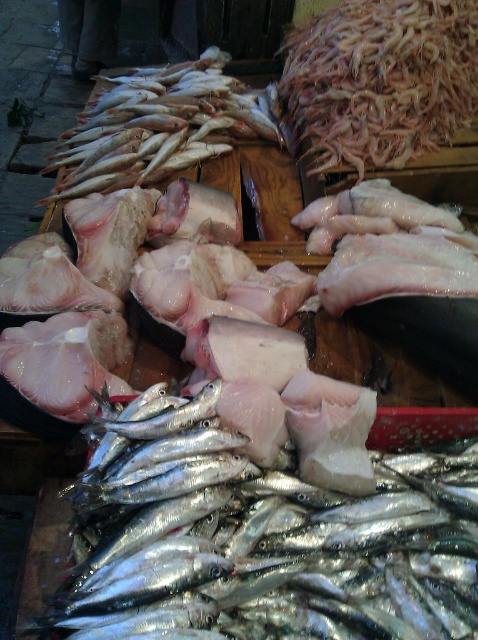
Question: Does pinkish-white shrimp at upper center appear on the right side of shiny silver fish at upper left?

Choices:
 (A) no
 (B) yes

Answer: (B)

Question: Which point is closer to the camera taking this photo?

Choices:
 (A) (401, 554)
 (B) (360, 164)

Answer: (A)

Question: Which object is farther from the camera taking this photo?

Choices:
 (A) shiny silver fish at upper left
 (B) pinkish-white shrimp at upper center

Answer: (A)

Question: Which object is positioned farthest from the shiny silver fish at center?

Choices:
 (A) pinkish-white shrimp at upper center
 (B) shiny silver fish at upper left

Answer: (B)

Question: Is shiny silver fish at center thinner than pinkish-white shrimp at upper center?

Choices:
 (A) yes
 (B) no

Answer: (B)

Question: Does shiny silver fish at center appear on the left side of pinkish-white shrimp at upper center?

Choices:
 (A) no
 (B) yes

Answer: (B)